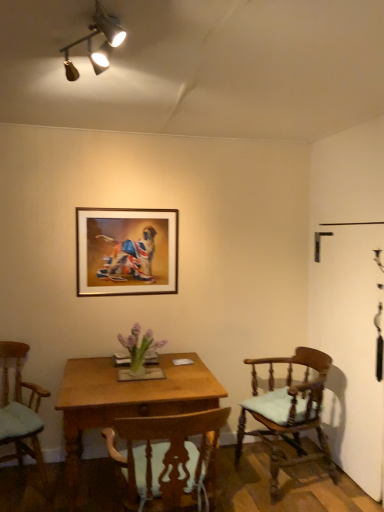
Locate an element on the screen. The width and height of the screenshot is (384, 512). blank space situated above gold-framed picture at upper center (from a real-world perspective) is located at coordinates (139, 204).